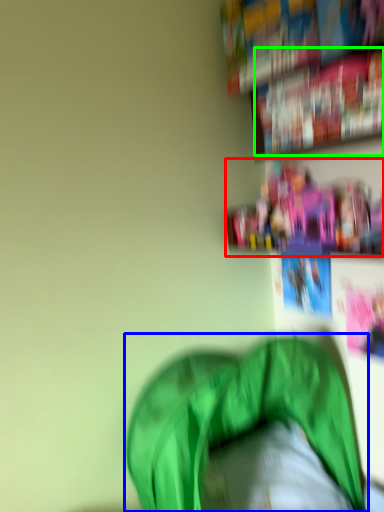
Question: Considering the real-world distances, which object is farthest from shelf (highlighted by a red box)? bean bag chair (highlighted by a blue box) or book (highlighted by a green box)?

Choices:
 (A) bean bag chair
 (B) book

Answer: (A)